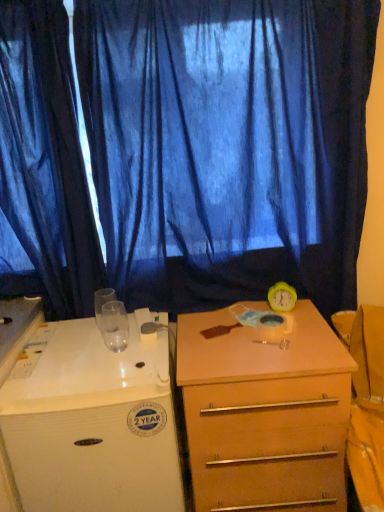
Question: In which direction should I rotate to look at blue sheer curtain at upper center, which is the second curtain in left-to-right order?

Choices:
 (A) right
 (B) left

Answer: (B)

Question: Is white glossy desk at left bigger than blue sheer curtain at upper center, which is the second curtain in left-to-right order?

Choices:
 (A) no
 (B) yes

Answer: (B)

Question: Is white glossy desk at left wider than blue sheer curtain at upper center, the first curtain in the right-to-left sequence?

Choices:
 (A) yes
 (B) no

Answer: (A)

Question: Is white glossy desk at left taller than blue sheer curtain at upper center, the first curtain in the right-to-left sequence?

Choices:
 (A) yes
 (B) no

Answer: (B)

Question: Are white glossy desk at left and blue sheer curtain at upper center, which is the second curtain in left-to-right order, located far from each other?

Choices:
 (A) yes
 (B) no

Answer: (B)

Question: Can you confirm if white glossy desk at left is smaller than blue sheer curtain at upper center, which is the second curtain in left-to-right order?

Choices:
 (A) no
 (B) yes

Answer: (A)

Question: Can you confirm if white glossy desk at left is shorter than blue sheer curtain at upper center, which is the second curtain in left-to-right order?

Choices:
 (A) no
 (B) yes

Answer: (B)

Question: Does blue sheer curtain at upper center, which is the second curtain in left-to-right order, have a greater height compared to white glossy desk at left?

Choices:
 (A) yes
 (B) no

Answer: (A)

Question: Does blue sheer curtain at upper center, the first curtain in the right-to-left sequence, have a lesser width compared to white glossy desk at left?

Choices:
 (A) no
 (B) yes

Answer: (B)

Question: Does blue sheer curtain at upper center, which is the second curtain in left-to-right order, contain white glossy desk at left?

Choices:
 (A) yes
 (B) no

Answer: (B)

Question: Considering the relative sizes of blue sheer curtain at upper center, which is the second curtain in left-to-right order, and white glossy desk at left in the image provided, is blue sheer curtain at upper center, which is the second curtain in left-to-right order, smaller than white glossy desk at left?

Choices:
 (A) yes
 (B) no

Answer: (A)

Question: From the image's perspective, is blue sheer curtain at upper center, which is the second curtain in left-to-right order, located above white glossy desk at left?

Choices:
 (A) no
 (B) yes

Answer: (B)

Question: Considering the relative positions of blue sheer curtain at upper center, which is the second curtain in left-to-right order, and white glossy desk at left in the image provided, is blue sheer curtain at upper center, which is the second curtain in left-to-right order, to the right of white glossy desk at left from the viewer's perspective?

Choices:
 (A) no
 (B) yes

Answer: (B)

Question: From the image's perspective, does white glossy desk at left appear lower than light brown wood drawer at center?

Choices:
 (A) no
 (B) yes

Answer: (B)